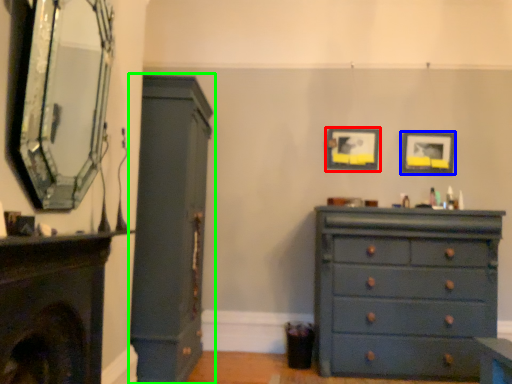
Question: Considering the real-world distances, which object is closest to picture frame (highlighted by a red box)? picture frame (highlighted by a blue box) or cupboard (highlighted by a green box).

Choices:
 (A) picture frame
 (B) cupboard

Answer: (A)